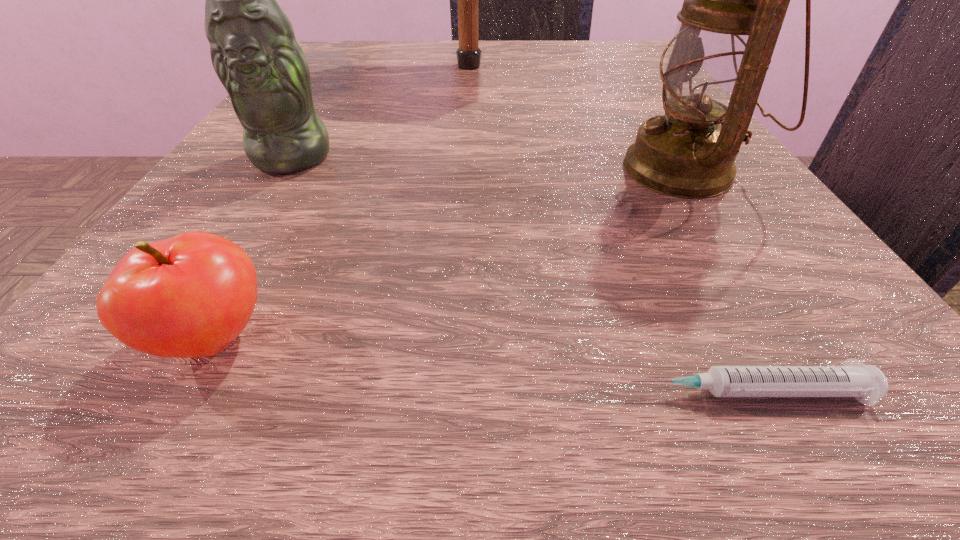
Identify the location of free space that is in between the fourth tallest object and the mallet. (341, 202).

Locate an element on the screen. The image size is (960, 540). empty space that is in between the oil lamp and the shortest object is located at coordinates (714, 280).

You are a GUI agent. You are given a task and a screenshot of the screen. Output one action in this format:
    pyautogui.click(x=<x>, y=<y>)
    Task: Click on the vacant region between the farthest object and the oil lamp
    
    Given the screenshot: What is the action you would take?
    pyautogui.click(x=575, y=118)

Locate an element on the screen. The width and height of the screenshot is (960, 540). free spot between the farthest object and the oil lamp is located at coordinates (575, 118).

Find the location of a particular element. The width and height of the screenshot is (960, 540). vacant space in between the farthest object and the fourth tallest object is located at coordinates (341, 202).

Where is `vacant space that is in between the apple and the syringe`? The image size is (960, 540). vacant space that is in between the apple and the syringe is located at coordinates (480, 365).

Locate an element on the screen. Image resolution: width=960 pixels, height=540 pixels. unoccupied position between the apple and the beer bottle is located at coordinates (253, 248).

Point out which object is positioned as the second nearest to the apple. Please provide its 2D coordinates. Your answer should be formatted as a tuple, i.e. [(x, y)], where the tuple contains the x and y coordinates of a point satisfying the conditions above.

[(866, 383)]

Where is `object that can be found as the fourth closest to the shortest object`? This screenshot has height=540, width=960. object that can be found as the fourth closest to the shortest object is located at coordinates [468, 54].

The height and width of the screenshot is (540, 960). I want to click on free space that satisfies the following two spatial constraints: 1. on the striking surface of the third object from right to left; 2. on the back side of the oil lamp, so click(462, 170).